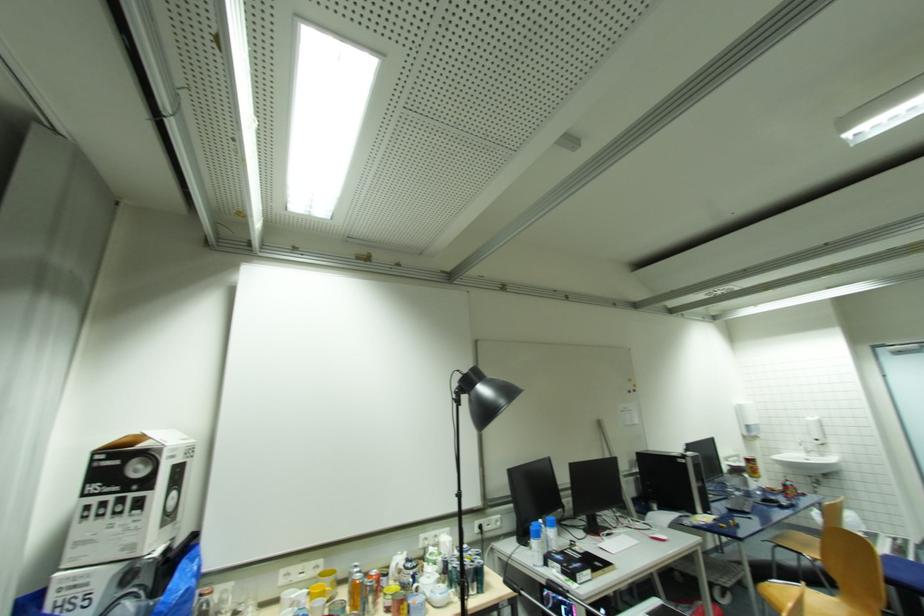
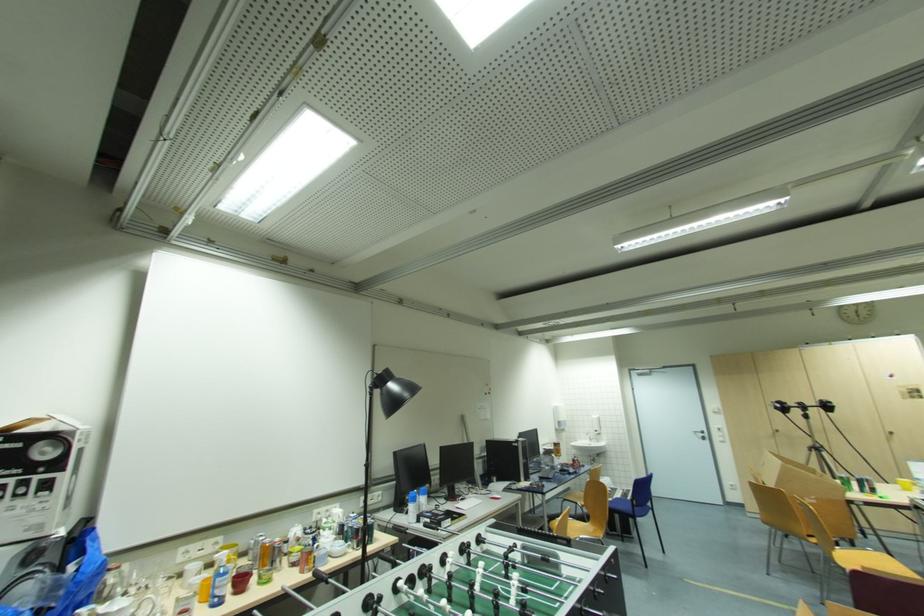
Locate, in the second image, the point that corresponds to pixel 550 565 in the first image.

(420, 522)